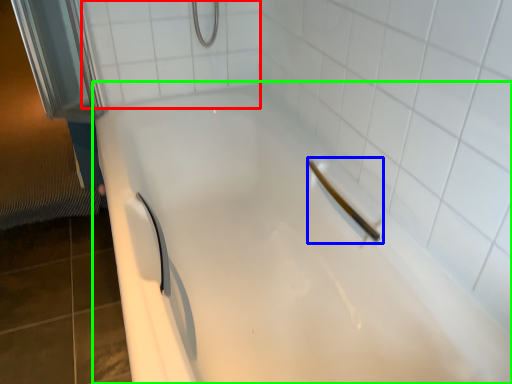
Question: Which is farther away from ceramic tile (highlighted by a red box)? shower (highlighted by a blue box) or bathtub (highlighted by a green box)?

Choices:
 (A) shower
 (B) bathtub

Answer: (A)